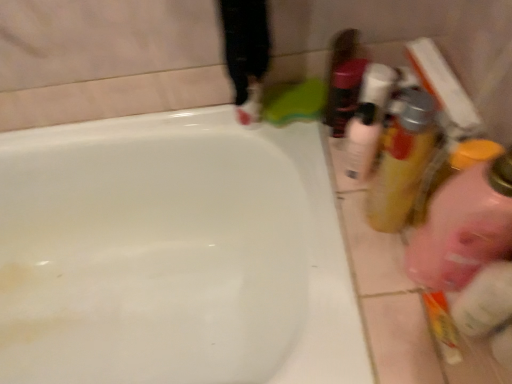
Question: From a real-world perspective, is pink translucent bottle at right positioned above or below translucent plastic mouthwash at right, which ranks as the second mouthwash in left-to-right order?

Choices:
 (A) above
 (B) below

Answer: (A)

Question: Would you say pink translucent bottle at right is to the left or to the right of translucent plastic mouthwash at right, which ranks as the second mouthwash in left-to-right order, in the picture?

Choices:
 (A) right
 (B) left

Answer: (A)

Question: Which object is the farthest from the white glossy mouthwash at upper right, which ranks as the 2th mouthwash in right-to-left order?

Choices:
 (A) pink translucent bottle at right
 (B) translucent plastic bottle at upper right
 (C) white glossy bathtub at upper center
 (D) translucent plastic mouthwash at right, the 1th mouthwash when ordered from right to left

Answer: (C)

Question: Which object is positioned farthest from the pink translucent bottle at right?

Choices:
 (A) white glossy mouthwash at upper right, positioned as the first mouthwash in left-to-right order
 (B) white glossy bathtub at upper center
 (C) translucent plastic mouthwash at right, the 1th mouthwash when ordered from right to left
 (D) translucent plastic bottle at upper right

Answer: (B)